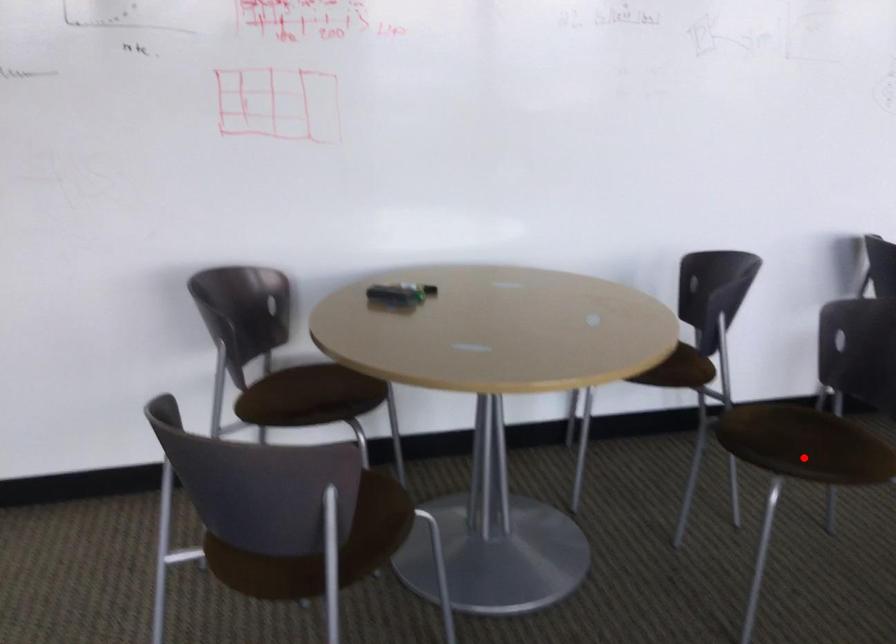
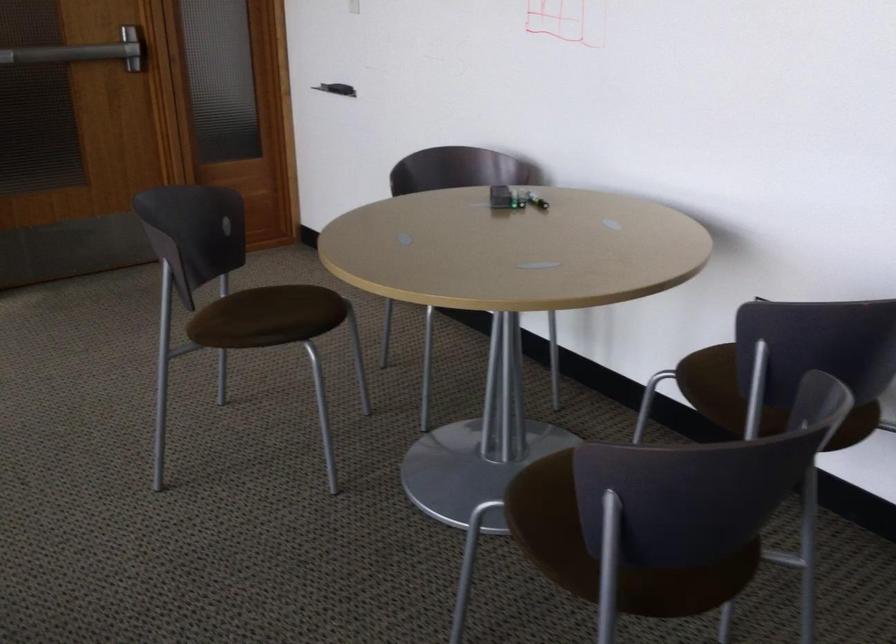
Where in the second image is the point corresponding to the highlighted location from the first image?

(554, 524)